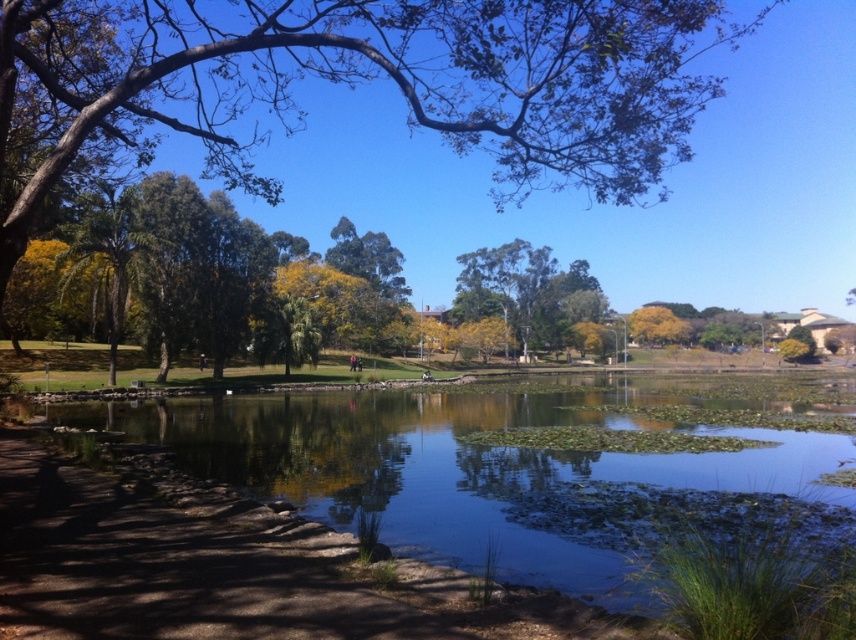
Looking at this image, you are a bird looking for a place to perch. You see the green leafy tree at upper center and the clear water at center. Which location is taller?

The green leafy tree at upper center is taller than the clear water at center, so it is the better option for perching.

You are planning to take a photo of the green leafy tree at upper center and the clear water at center. Which object will appear bigger in the photo?

The green leafy tree at upper center will appear bigger in the photo because it has a larger size compared to the clear water at center according to the description.